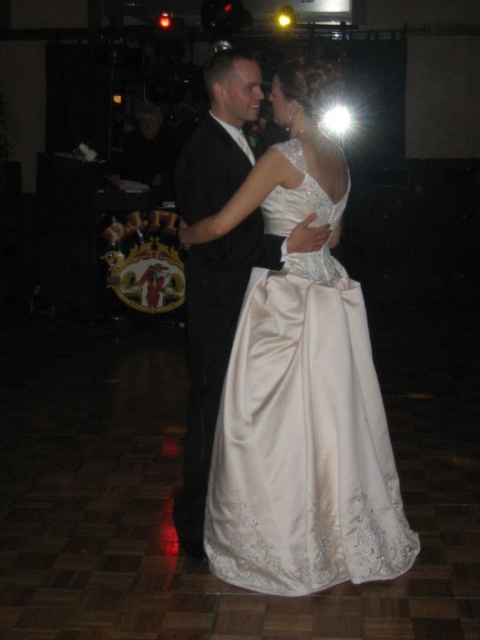
You are standing in the banquet hall and want to place a small decoration between the two points labeled point (350,420) and point (187,515). Since the floor is sloped, will the decoration roll towards the DJ booth or away from it?

The decoration will roll away from the DJ booth because point (350,420) is closer to the camera than point (187,515), indicating the slope is descending towards the DJ booth direction.

From the picture: You are standing in the banquet hall and want to reach a specific point marked at coordinates point (256, 584). If you are currently 2 meters away from this point, how much further do you need to walk to reach it?

The distance of point (256, 584) from viewer is 2.32 meters. Since you are currently 2 meters away, you need to walk an additional 0.32 meters to reach the point.